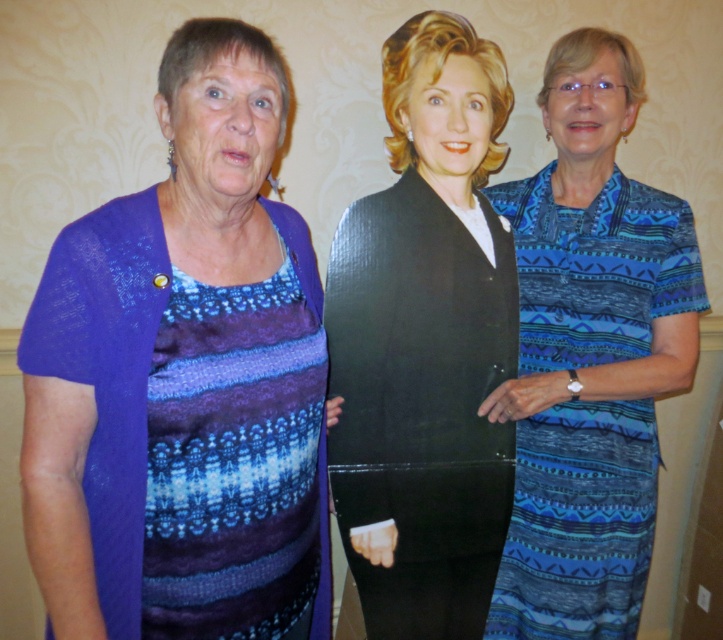
Is knitted purple cardigan at left further to the viewer compared to blue printed dress at right?

No, knitted purple cardigan at left is closer to the viewer.

Is point (38, 552) positioned before point (505, 412)?

Yes, point (38, 552) is closer to viewer.

The height and width of the screenshot is (640, 723). In order to click on knitted purple cardigan at left in this screenshot , I will do `click(183, 380)`.

Image resolution: width=723 pixels, height=640 pixels. Identify the location of knitted purple cardigan at left. (183, 380).

Between knitted purple cardigan at left and black glossy vest at center, which one appears on the left side from the viewer's perspective?

Positioned to the left is knitted purple cardigan at left.

Which is below, knitted purple cardigan at left or black glossy vest at center?

knitted purple cardigan at left is lower down.

Where is `knitted purple cardigan at left`? This screenshot has width=723, height=640. knitted purple cardigan at left is located at coordinates (183, 380).

The width and height of the screenshot is (723, 640). In order to click on knitted purple cardigan at left in this screenshot , I will do `click(183, 380)`.

Does point (406, 589) lie in front of point (633, 464)?

Yes, point (406, 589) is in front of point (633, 464).

Does point (419, 157) come closer to viewer compared to point (609, 516)?

Yes, point (419, 157) is in front of point (609, 516).

Locate an element on the screen. This screenshot has width=723, height=640. black glossy vest at center is located at coordinates (427, 340).